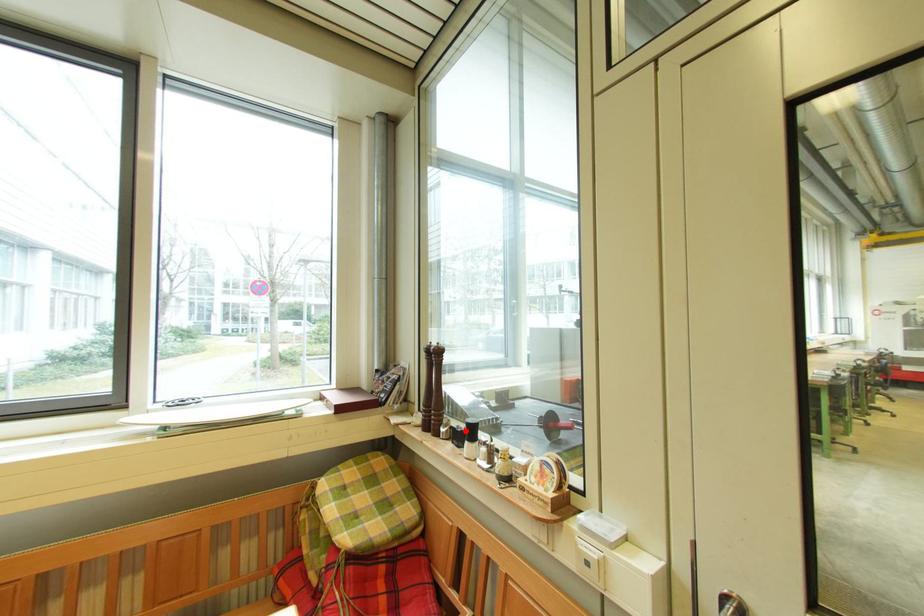
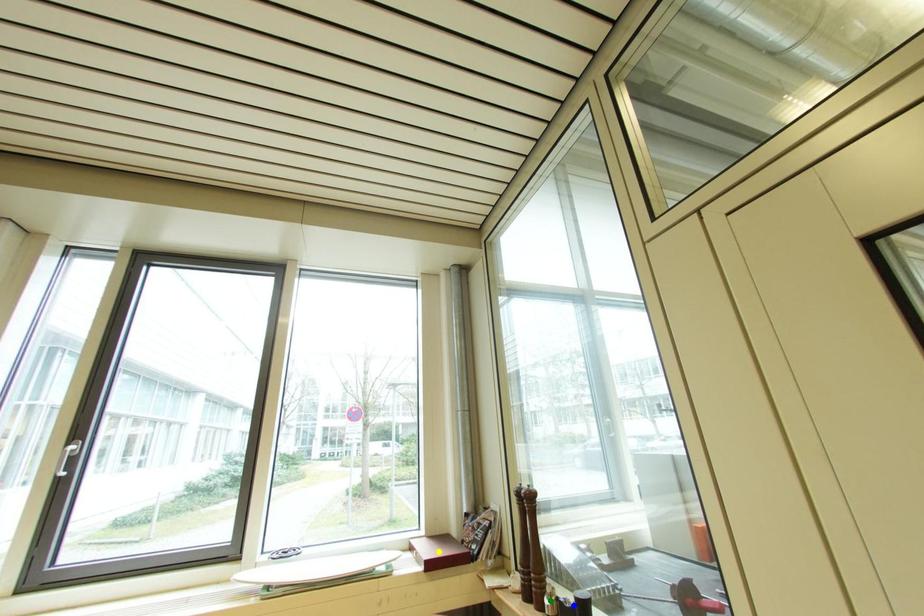
Question: I am providing you with two images of the same scene from different viewpoints. A red point is marked on the first image. You are given multiple points on the second image. In image 2, which mark is for the same physical point as the one in image 1?

Choices:
 (A) green point
 (B) blue point
 (C) yellow point

Answer: (B)